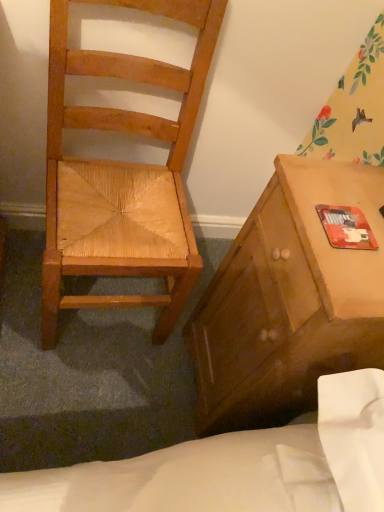
Question: Considering the relative sizes of natural wood chair at left and matte wooden cabinet at right in the image provided, is natural wood chair at left thinner than matte wooden cabinet at right?

Choices:
 (A) no
 (B) yes

Answer: (A)

Question: Is natural wood chair at left facing away from matte wooden cabinet at right?

Choices:
 (A) no
 (B) yes

Answer: (A)

Question: Can you confirm if natural wood chair at left is positioned to the left of matte wooden cabinet at right?

Choices:
 (A) no
 (B) yes

Answer: (B)

Question: Is natural wood chair at left positioned in front of matte wooden cabinet at right?

Choices:
 (A) no
 (B) yes

Answer: (B)

Question: Can you confirm if natural wood chair at left is positioned to the right of matte wooden cabinet at right?

Choices:
 (A) no
 (B) yes

Answer: (A)

Question: Does natural wood chair at left have a greater width compared to matte wooden cabinet at right?

Choices:
 (A) yes
 (B) no

Answer: (A)

Question: Can natural wood chair at left be found inside matte wooden cabinet at right?

Choices:
 (A) yes
 (B) no

Answer: (B)

Question: Is matte wooden cabinet at right located outside natural wood chair at left?

Choices:
 (A) no
 (B) yes

Answer: (B)

Question: From a real-world perspective, is matte wooden cabinet at right on natural wood chair at left?

Choices:
 (A) yes
 (B) no

Answer: (B)

Question: From the image's perspective, is matte wooden cabinet at right above natural wood chair at left?

Choices:
 (A) yes
 (B) no

Answer: (B)

Question: Considering the relative sizes of matte wooden cabinet at right and natural wood chair at left in the image provided, is matte wooden cabinet at right taller than natural wood chair at left?

Choices:
 (A) no
 (B) yes

Answer: (A)

Question: Is matte wooden cabinet at right to the left of natural wood chair at left from the viewer's perspective?

Choices:
 (A) yes
 (B) no

Answer: (B)

Question: From the image's perspective, is red matte mouse pad at right below matte wooden cabinet at right?

Choices:
 (A) no
 (B) yes

Answer: (A)